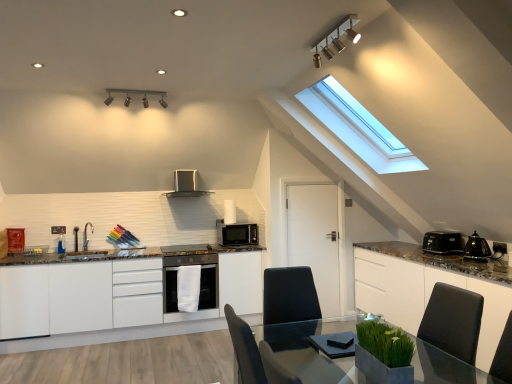
Locate an element on the screen. The width and height of the screenshot is (512, 384). vacant space situated above metallic track lights at upper center, acting as the first light fixture starting from the right (from a real-world perspective) is located at coordinates (318, 37).